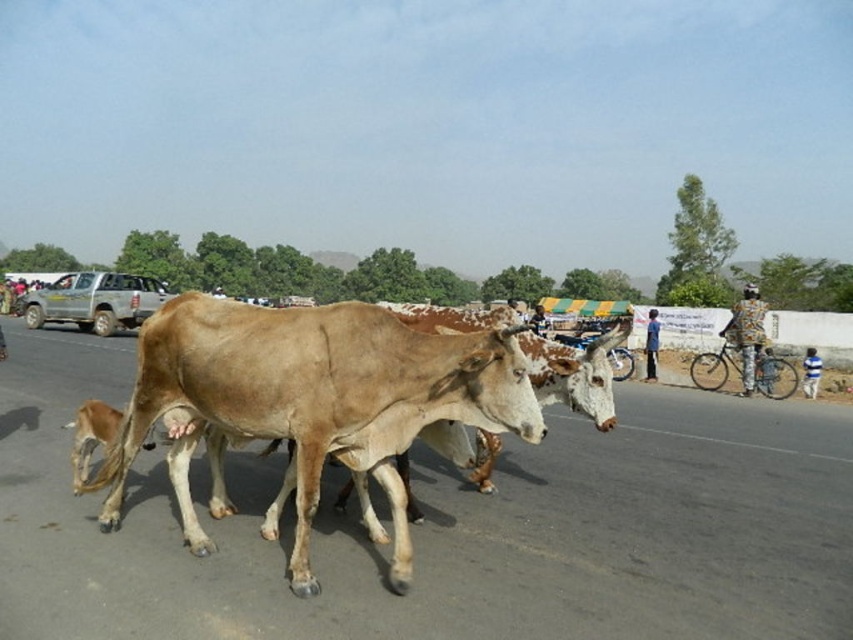
You are a pedestrian standing on the side of the road where the light brown smooth cow at center is crossing. You want to get to the silver metallic pickup truck at center. Is the cow blocking your path to the truck?

The light brown smooth cow at center is below the silver metallic pickup truck at center, meaning the cow is closer to you and positioned in front of the truck. Therefore, the cow is blocking your path to the silver metallic pickup truck at center.

You are a GPS navigation system guiding a driver approaching the scene. The driver needs to stop before reaching the light brown smooth cow at center. The cow is located at coordinates point 0.623, 0.368. What is the earliest point along the road where the driver should start braking to ensure stopping before the cow?

The light brown smooth cow at center is positioned at coordinates point (312, 397). The driver should start braking before reaching this point to ensure stopping before the cow.